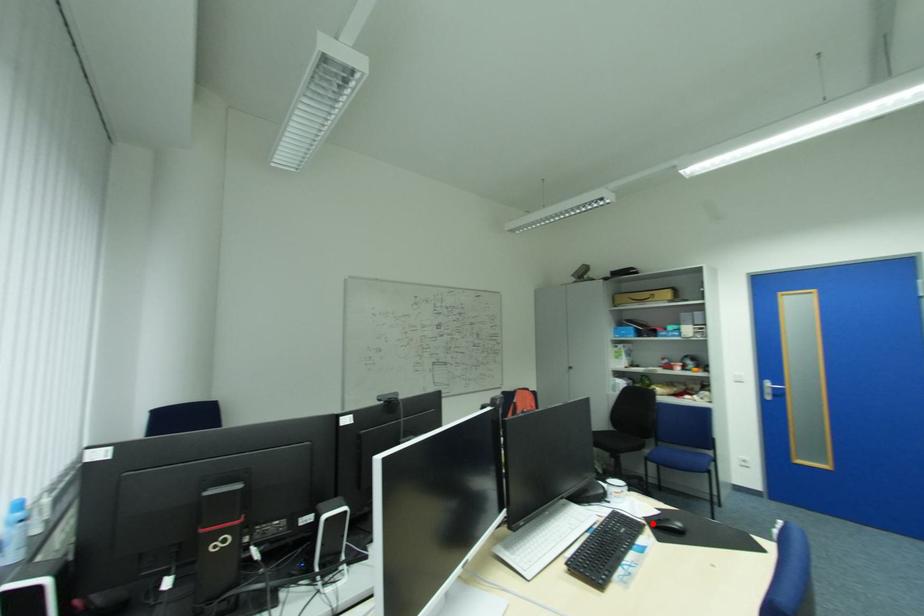
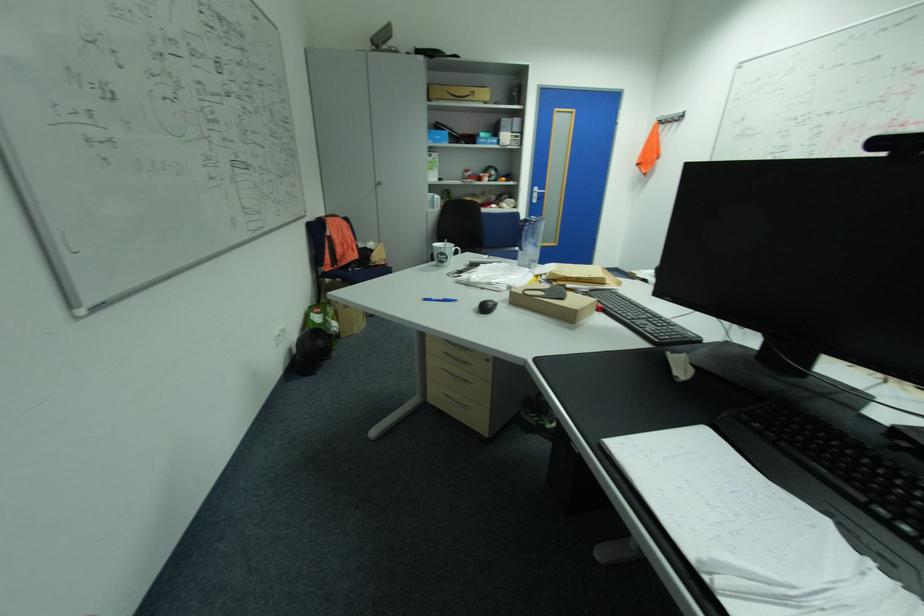
Question: I am providing you with two images of the same scene from different viewpoints. A red point is marked on the first image. At the location where the point appears in image 1, is it still visible in image 2?

Choices:
 (A) Yes
 (B) No

Answer: (B)